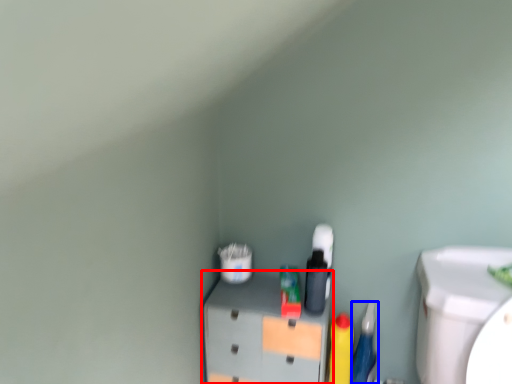
Question: Among these objects, which one is nearest to the camera, furniture (highlighted by a red box) or stationery (highlighted by a blue box)?

Choices:
 (A) furniture
 (B) stationery

Answer: (A)